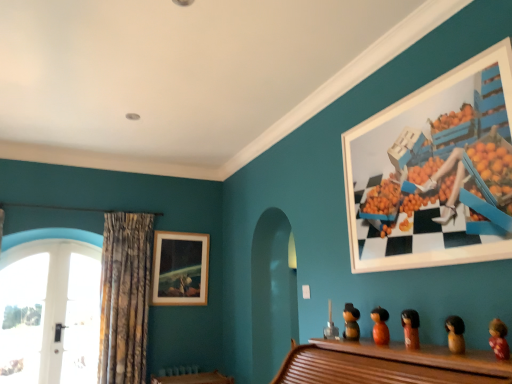
Question: From a real-world perspective, is white matte picture frame at upper right, which ranks as the 1th picture frame in right-to-left order, positioned over brown wooden doll at lower right, which is the fourth toy in left-to-right order, based on gravity?

Choices:
 (A) yes
 (B) no

Answer: (A)

Question: Is white matte picture frame at upper right, which is counted as the 1th picture frame, starting from the front, with brown wooden doll at lower right, which ranks as the fourth toy in back-to-front order?

Choices:
 (A) no
 (B) yes

Answer: (A)

Question: Can you confirm if white matte picture frame at upper right, which ranks as the 1th picture frame in right-to-left order, is wider than brown wooden doll at lower right, which ranks as the fourth toy in back-to-front order?

Choices:
 (A) yes
 (B) no

Answer: (B)

Question: From the image's perspective, is white matte picture frame at upper right, the 2th picture frame positioned from the left, on top of brown wooden doll at lower right, which appears as the 2th toy when viewed from the right?

Choices:
 (A) yes
 (B) no

Answer: (A)

Question: Is white matte picture frame at upper right, the first picture frame in the top-to-bottom sequence, taller than brown wooden doll at lower right, which appears as the 2th toy when viewed from the right?

Choices:
 (A) yes
 (B) no

Answer: (A)

Question: Does white matte picture frame at upper right, which ranks as the 2th picture frame in bottom-to-top order, appear on the right side of brown wooden doll at lower right, the second toy from the front?

Choices:
 (A) no
 (B) yes

Answer: (B)

Question: Is brown wooden figurine at center, acting as the 3th toy starting from the back, at the left side of fluffy pink doll at lower right, acting as the fifth toy starting from the back?

Choices:
 (A) no
 (B) yes

Answer: (B)

Question: Is brown wooden figurine at center, which is the third toy from left to right, in contact with fluffy pink doll at lower right, which is the 5th toy in left-to-right order?

Choices:
 (A) no
 (B) yes

Answer: (A)

Question: From a real-world perspective, is brown wooden figurine at center, which is the 3th toy from front to back, beneath fluffy pink doll at lower right, acting as the fifth toy starting from the back?

Choices:
 (A) yes
 (B) no

Answer: (B)

Question: Does brown wooden figurine at center, acting as the 3th toy starting from the back, come in front of fluffy pink doll at lower right, acting as the fifth toy starting from the back?

Choices:
 (A) yes
 (B) no

Answer: (B)

Question: Does brown wooden figurine at center, acting as the 3th toy starting from the back, have a smaller size compared to fluffy pink doll at lower right, which is counted as the 1th toy, starting from the front?

Choices:
 (A) no
 (B) yes

Answer: (A)

Question: Is brown wooden figurine at center, which is the third toy from left to right, far from fluffy pink doll at lower right, which is the 5th toy in left-to-right order?

Choices:
 (A) yes
 (B) no

Answer: (B)

Question: Is wooden picture frame at upper center, acting as the first picture frame starting from the bottom, wider than brown wooden doll at lower right, which ranks as the fourth toy in back-to-front order?

Choices:
 (A) yes
 (B) no

Answer: (A)